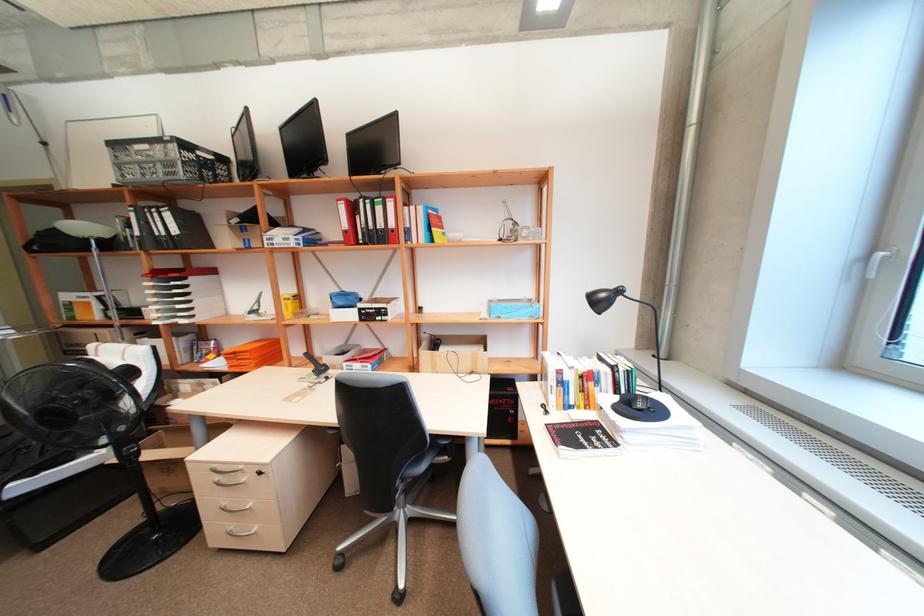
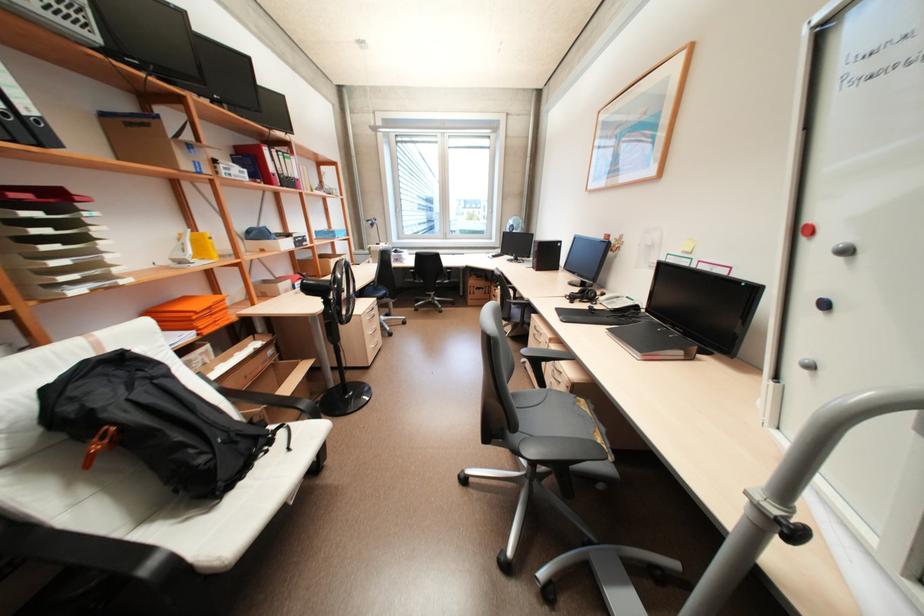
In the second image, find the point that corresponds to [183,248] in the first image.

(46, 146)